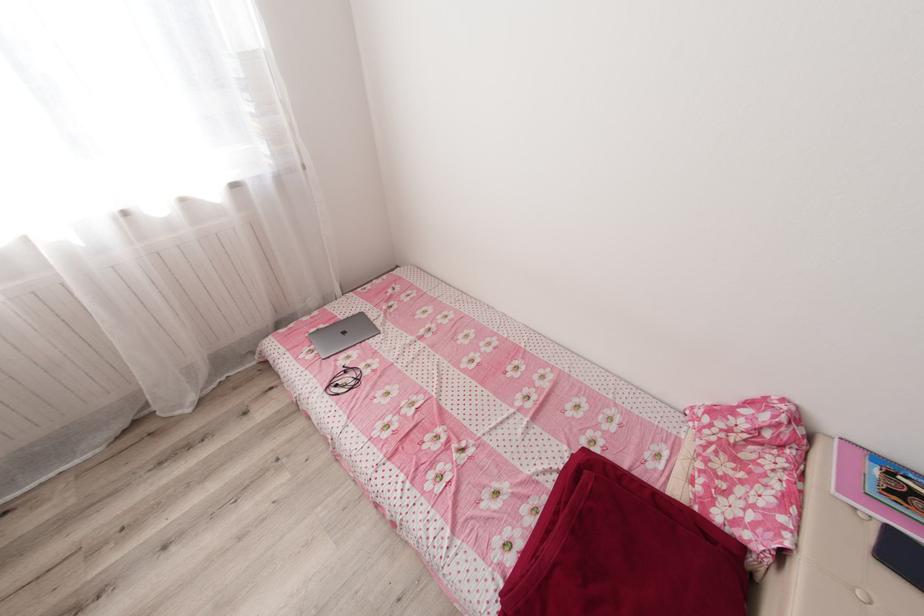
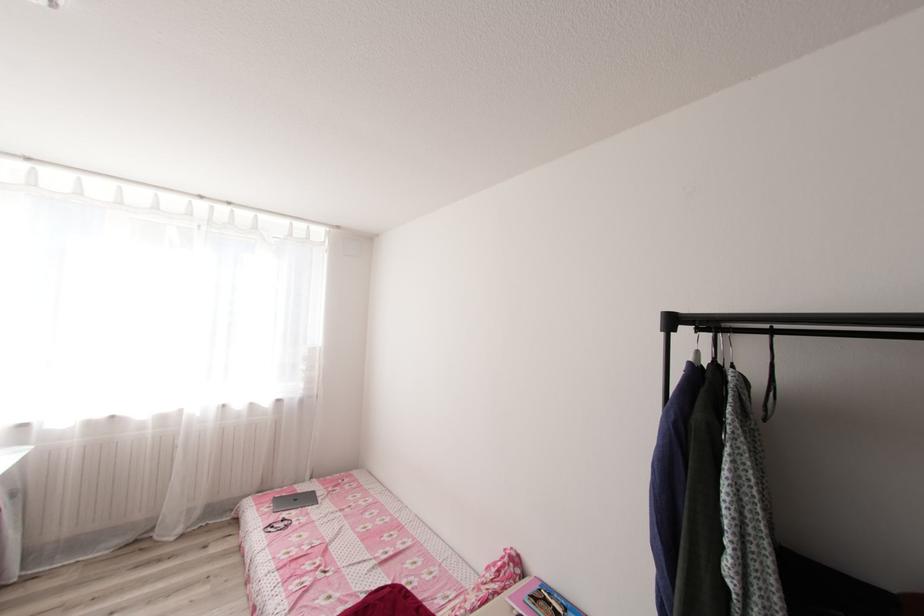
In the second image, find the point that corresponds to [348,333] in the first image.

(300, 499)